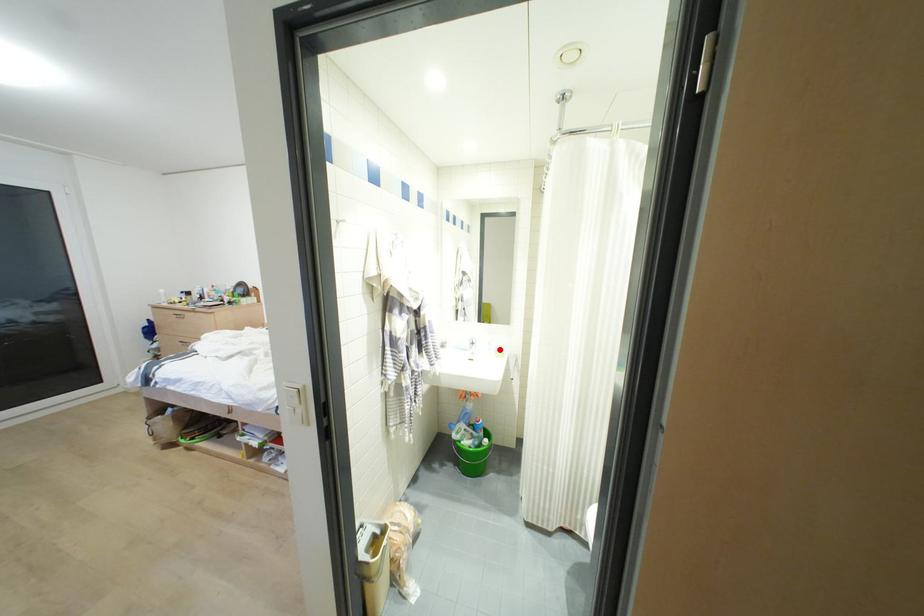
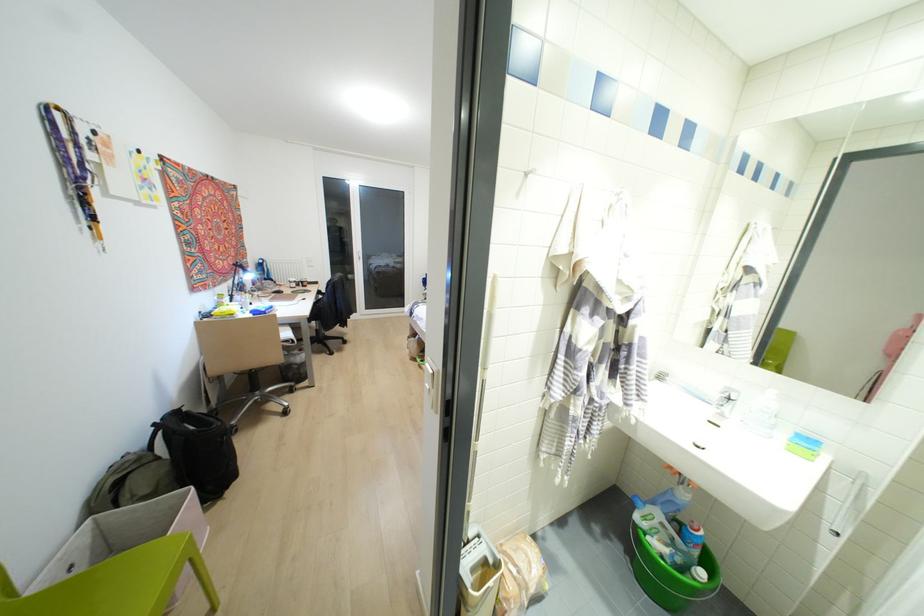
Where in the second image is the point corresponding to the highlighted location from the first image?

(807, 440)